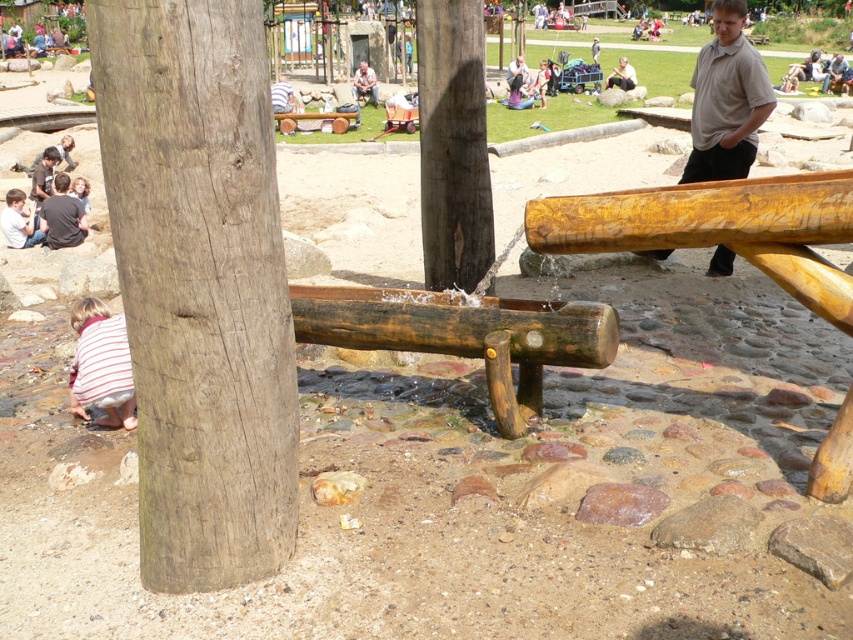
Question: Which of the following is the farthest from the observer?

Choices:
 (A) (236, 288)
 (B) (78, 184)
 (C) (611, 74)
 (D) (375, 104)

Answer: (C)

Question: Is the position of weathered wood pole at center less distant than that of brown leather jacket at lower left?

Choices:
 (A) no
 (B) yes

Answer: (B)

Question: Which of the following is the closest to the observer?

Choices:
 (A) (730, 99)
 (B) (368, 83)
 (C) (671, 228)
 (D) (631, 76)

Answer: (C)

Question: Does brown rough wood at left appear under striped shirt at lower left?

Choices:
 (A) yes
 (B) no

Answer: (B)

Question: Which of the following is the farthest from the observer?

Choices:
 (A) dark gray shirt at lower left
 (B) brown leather jacket at lower left

Answer: (B)

Question: Does brown wooden bench at center have a larger size compared to light brown wooden bench at upper center?

Choices:
 (A) yes
 (B) no

Answer: (A)